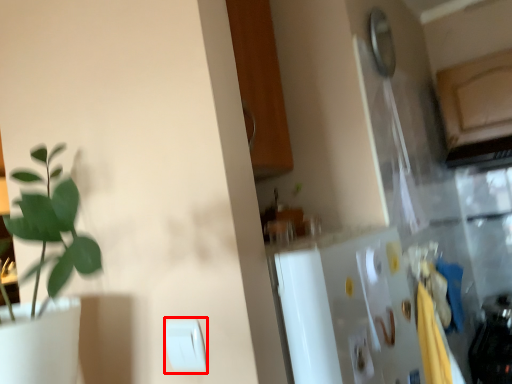
Question: From the image's perspective, where is light switch (annotated by the red box) located in relation to light switch in the image?

Choices:
 (A) below
 (B) above

Answer: (B)